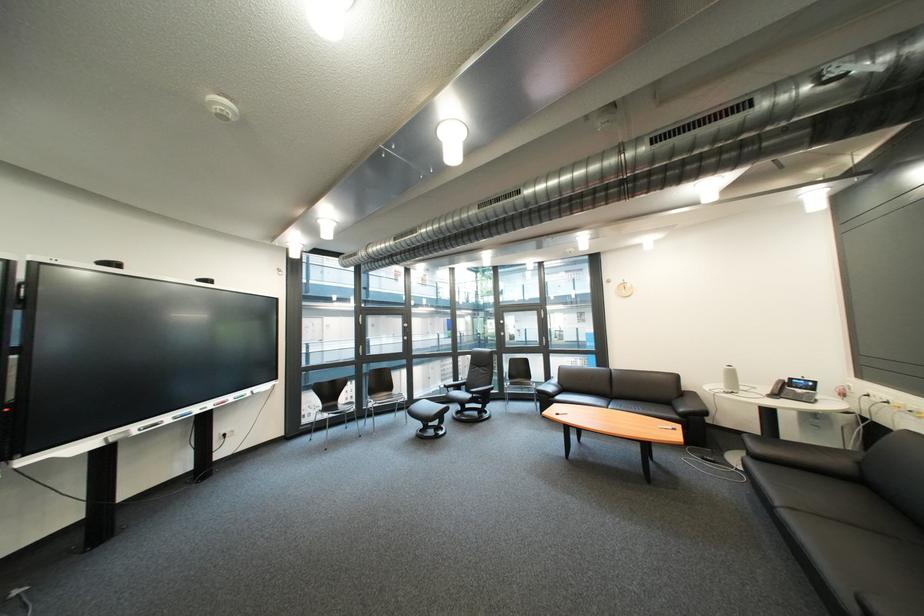
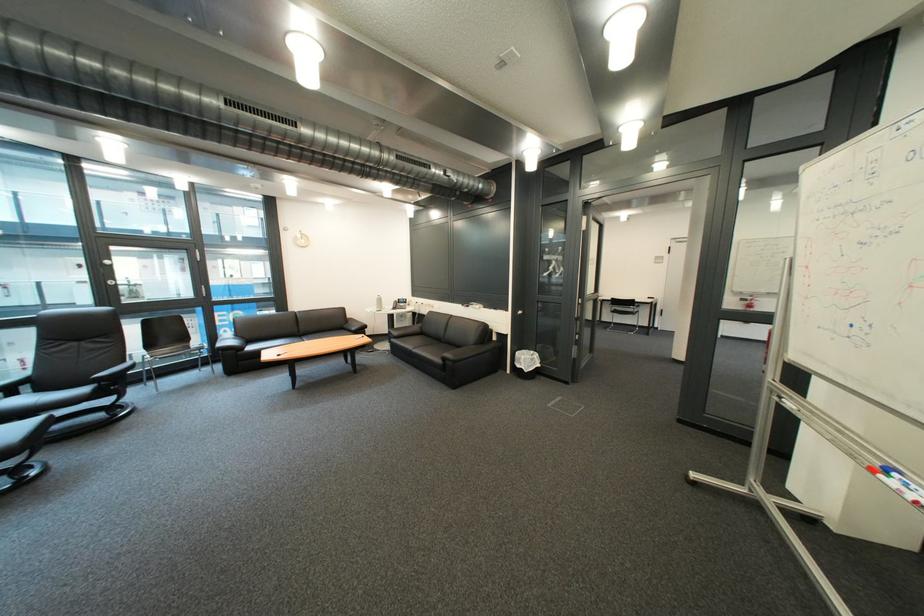
Where in the second image is the point corresponding to (x=625, y=395) from the first image?

(312, 334)